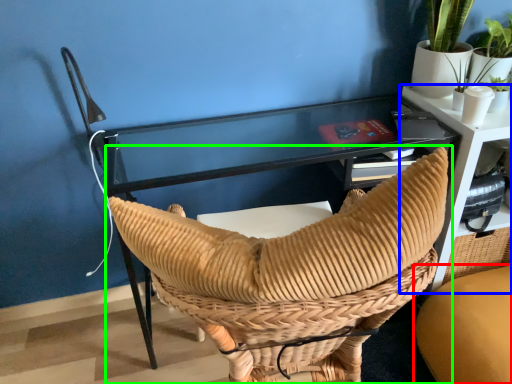
Question: Considering the real-world distances, which object is closest to chair (highlighted by a red box)? table (highlighted by a blue box) or chair (highlighted by a green box).

Choices:
 (A) table
 (B) chair

Answer: (A)